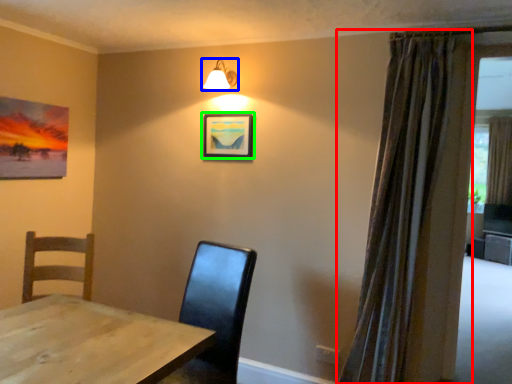
Question: Which object is the closest to the curtain (highlighted by a red box)? Choose among these: lamp (highlighted by a blue box) or picture frame (highlighted by a green box).

Choices:
 (A) lamp
 (B) picture frame

Answer: (B)